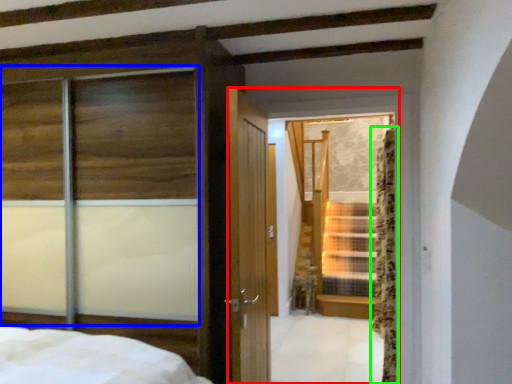
Question: Which is farther away from glass door (highlighted by a red box)? window (highlighted by a blue box) or curtain (highlighted by a green box)?

Choices:
 (A) window
 (B) curtain

Answer: (B)